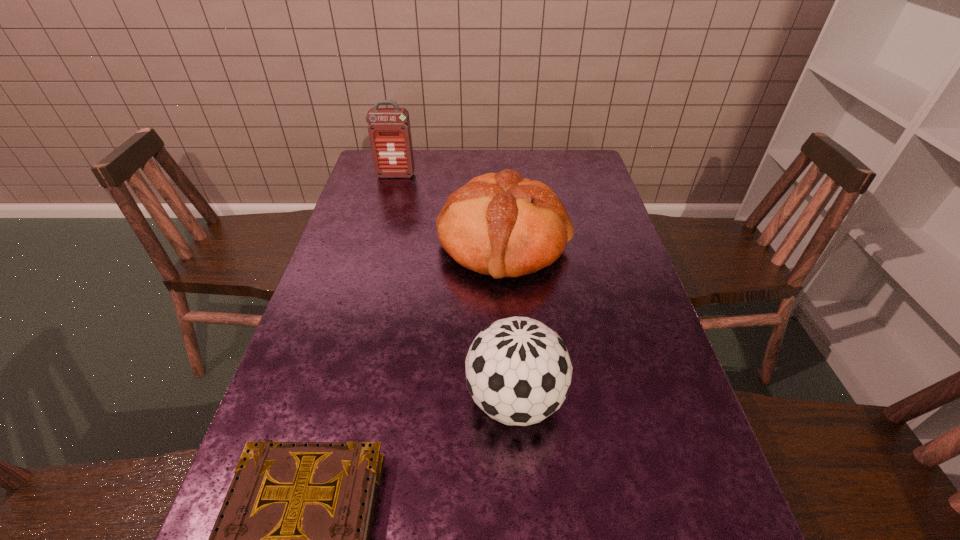
The width and height of the screenshot is (960, 540). In order to click on the tallest object in this screenshot , I will do `click(389, 130)`.

Find the location of `the farthest object`. the farthest object is located at coordinates (389, 130).

The height and width of the screenshot is (540, 960). In order to click on soccer ball in this screenshot , I will do `click(518, 371)`.

Find the location of a particular element. The width and height of the screenshot is (960, 540). the third nearest object is located at coordinates (500, 224).

Where is `vacant space located on the front-facing side of the farthest object`? This screenshot has height=540, width=960. vacant space located on the front-facing side of the farthest object is located at coordinates (376, 246).

Image resolution: width=960 pixels, height=540 pixels. I want to click on vacant space situated on the front of the soccer ball, so click(523, 514).

The height and width of the screenshot is (540, 960). In order to click on vacant space situated 0.200m on the back of the third nearest object in this screenshot , I will do `click(499, 174)`.

Find the location of `object present at the far edge`. object present at the far edge is located at coordinates (389, 130).

The width and height of the screenshot is (960, 540). In order to click on object that is at the left edge in this screenshot , I will do `click(389, 130)`.

Identify the location of object located at the right edge. This screenshot has height=540, width=960. (500, 224).